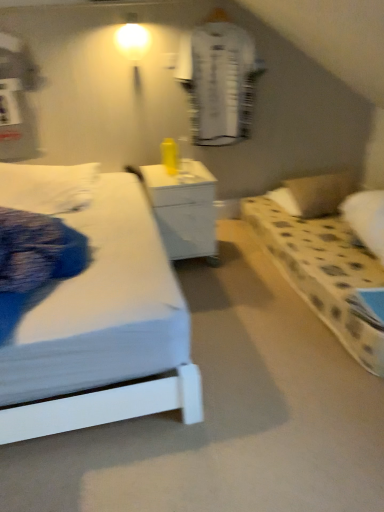
Measure the distance between matte white bulb at upper center and camera.

The distance of matte white bulb at upper center from camera is 8.87 feet.

Where is `white glossy nightstand at center`? This screenshot has height=512, width=384. white glossy nightstand at center is located at coordinates (184, 209).

The width and height of the screenshot is (384, 512). Find the location of `white dotted pillow at right`. white dotted pillow at right is located at coordinates 320,192.

The height and width of the screenshot is (512, 384). What do you see at coordinates (320, 192) in the screenshot?
I see `white dotted pillow at right` at bounding box center [320, 192].

Locate an element on the screen. The width and height of the screenshot is (384, 512). white textured robe at upper center is located at coordinates (219, 81).

This screenshot has height=512, width=384. I want to click on matte white bulb at upper center, so click(x=133, y=46).

Could you tell me if white dotted pillow at right is turned towards white glossy nightstand at center?

No, white dotted pillow at right is not aimed at white glossy nightstand at center.

Considering the relative sizes of white dotted pillow at right and white glossy nightstand at center in the image provided, is white dotted pillow at right wider than white glossy nightstand at center?

Incorrect, the width of white dotted pillow at right does not surpass that of white glossy nightstand at center.

Which of these two, white dotted pillow at right or white glossy nightstand at center, is bigger?

white glossy nightstand at center.

Is point (347, 180) positioned after point (189, 232)?

That is True.

Is there a large distance between white textured robe at upper center and matte white bulb at upper center?

No.

Is white textured robe at upper center bigger than matte white bulb at upper center?

Yes.

I want to click on robe below the matte white bulb at upper center (from a real-world perspective), so click(x=219, y=81).

Can you confirm if white textured robe at upper center is thinner than matte white bulb at upper center?

Yes, white textured robe at upper center is thinner than matte white bulb at upper center.

Based on the photo, from the image's perspective, is white dotted pillow at right located beneath white textured robe at upper center?

Indeed, from the image's perspective, white dotted pillow at right is shown beneath white textured robe at upper center.

From a real-world perspective, is white dotted pillow at right over white textured robe at upper center?

Incorrect, from a real-world perspective, white dotted pillow at right is lower than white textured robe at upper center.

Is white dotted pillow at right aimed at white textured robe at upper center?

No, white dotted pillow at right does not turn towards white textured robe at upper center.

Considering the sizes of objects white dotted pillow at right and white textured robe at upper center in the image provided, who is wider, white dotted pillow at right or white textured robe at upper center?

With larger width is white dotted pillow at right.

Find the location of a particular element. pillow behind the white glossy nightstand at center is located at coordinates (320, 192).

Is white glossy nightstand at center looking in the opposite direction of white dotted pillow at right?

No, white glossy nightstand at center's orientation is not away from white dotted pillow at right.

From the image's perspective, does white glossy nightstand at center appear higher than white dotted pillow at right?

No, from the image's perspective, white glossy nightstand at center is not over white dotted pillow at right.

Which object is positioned more to the left, matte white bulb at upper center or white glossy nightstand at center?

matte white bulb at upper center is more to the left.

From the image's perspective, is matte white bulb at upper center above white glossy nightstand at center?

Yes, from the image's perspective, matte white bulb at upper center is above white glossy nightstand at center.

In order to click on nightstand on the right side of matte white bulb at upper center in this screenshot , I will do `click(184, 209)`.

Is matte white bulb at upper center wider or thinner than white glossy nightstand at center?

Considering their sizes, matte white bulb at upper center looks slimmer than white glossy nightstand at center.

Considering the relative sizes of white glossy nightstand at center and matte white bulb at upper center in the image provided, is white glossy nightstand at center smaller than matte white bulb at upper center?

Incorrect, white glossy nightstand at center is not smaller in size than matte white bulb at upper center.

Locate an element on the screen. nightstand on the right of matte white bulb at upper center is located at coordinates (184, 209).

Is white glossy nightstand at center looking in the opposite direction of matte white bulb at upper center?

No, matte white bulb at upper center is not at the back of white glossy nightstand at center.

Considering the sizes of objects white glossy nightstand at center and matte white bulb at upper center in the image provided, who is shorter, white glossy nightstand at center or matte white bulb at upper center?

matte white bulb at upper center is shorter.

Considering the points (185, 53) and (300, 189), which point is in front, point (185, 53) or point (300, 189)?

The point (185, 53) is more forward.

From the image's perspective, between white textured robe at upper center and white dotted pillow at right, who is located below?

white dotted pillow at right.

Identify the location of pillow behind the white textured robe at upper center. (320, 192).

Which object is positioned more to the right, white textured robe at upper center or white dotted pillow at right?

white dotted pillow at right.

Image resolution: width=384 pixels, height=512 pixels. Identify the location of nightstand lying on the left of white dotted pillow at right. (184, 209).

This screenshot has width=384, height=512. In order to click on robe below the matte white bulb at upper center (from the image's perspective) in this screenshot , I will do `click(219, 81)`.

From the image, which object appears to be nearer to white textured robe at upper center, matte white bulb at upper center or white glossy nightstand at center?

matte white bulb at upper center lies closer to white textured robe at upper center than the other object.

Based on their spatial positions, is white dotted pillow at right or matte white bulb at upper center closer to white glossy nightstand at center?

white dotted pillow at right lies closer to white glossy nightstand at center than the other object.

Which object lies further to the anchor point white glossy nightstand at center, white dotted pillow at right or white textured robe at upper center?

The object further to white glossy nightstand at center is white dotted pillow at right.

Considering their positions, is matte white bulb at upper center positioned further to white dotted pillow at right than white glossy nightstand at center?

matte white bulb at upper center.

Looking at the image, which one is located further to white dotted pillow at right, white textured robe at upper center or matte white bulb at upper center?

matte white bulb at upper center.

Looking at the image, which one is located further to white textured robe at upper center, white dotted pillow at right or white glossy nightstand at center?

white dotted pillow at right is positioned further to the anchor white textured robe at upper center.

From the image, which object appears to be farther from white dotted pillow at right, white textured robe at upper center or white glossy nightstand at center?

white textured robe at upper center is positioned further to the anchor white dotted pillow at right.

Which object lies nearer to the anchor point white textured robe at upper center, white glossy nightstand at center or white dotted pillow at right?

Based on the image, white glossy nightstand at center appears to be nearer to white textured robe at upper center.

Find the location of a particular element. Image resolution: width=384 pixels, height=512 pixels. robe between matte white bulb at upper center and white glossy nightstand at center vertically is located at coordinates (219, 81).

Find the location of a particular element. This screenshot has width=384, height=512. nightstand between matte white bulb at upper center and white dotted pillow at right from left to right is located at coordinates (184, 209).

You are a GUI agent. You are given a task and a screenshot of the screen. Output one action in this format:
    pyautogui.click(x=<x>, y=<y>)
    Task: Click on the robe between white glossy nightstand at center and white dotted pillow at right from left to right
    
    Given the screenshot: What is the action you would take?
    pyautogui.click(x=219, y=81)

Identify the location of robe located between matte white bulb at upper center and white dotted pillow at right in the left-right direction. The width and height of the screenshot is (384, 512). [x=219, y=81].